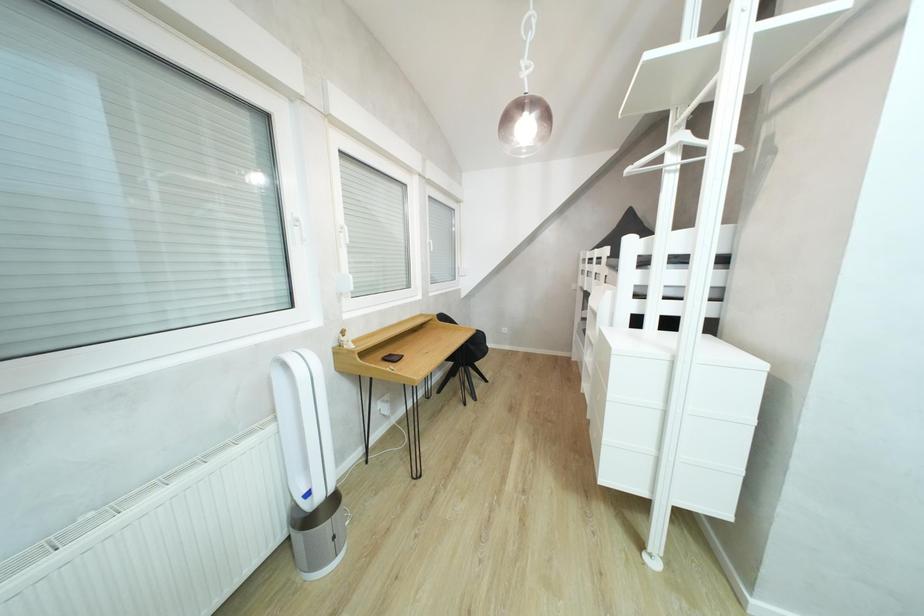
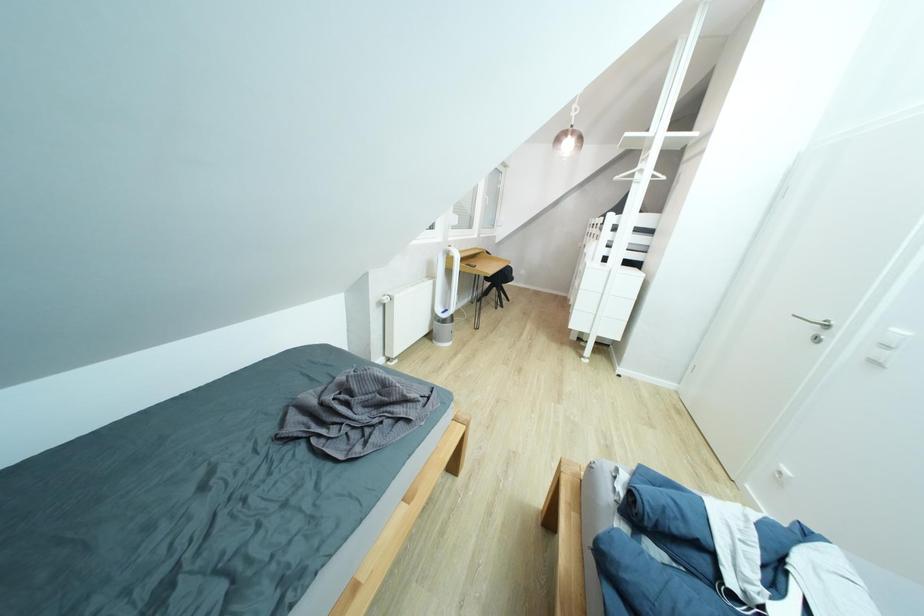
Which direction would the cameraman need to move to produce the second image?

The cameraman walked toward left, backward.